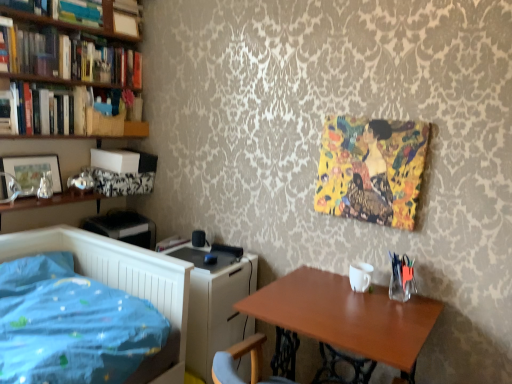
The width and height of the screenshot is (512, 384). Identify the location of free space above wooden table at lower right (from a real-world perspective). (351, 306).